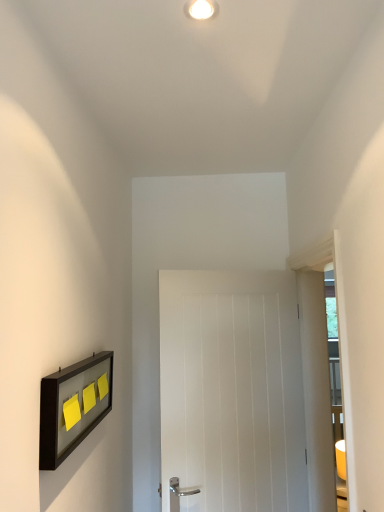
Question: Relative to matte black picture frame at left, is yellow matte/light switch at left, which is the 2th light switch in front-to-back order, in front or behind?

Choices:
 (A) front
 (B) behind

Answer: (B)

Question: From a real-world perspective, is yellow matte/light switch at left, which is the 2th light switch in front-to-back order, above or below matte black picture frame at left?

Choices:
 (A) below
 (B) above

Answer: (B)

Question: Which of these objects is positioned closest to the white glossy light fixture at upper center?

Choices:
 (A) yellow matte paper at left, positioned as the 1th light switch in front-to-back order
 (B) yellow matte/light switch at left, which is the 2th light switch in front-to-back order
 (C) matte black picture frame at left
 (D) transparent glass door at right
 (E) white wooden door at center

Answer: (A)

Question: Based on their relative distances, which object is farther from the matte black picture frame at left?

Choices:
 (A) yellow matte paper at left, positioned as the 1th light switch in front-to-back order
 (B) white wooden door at center
 (C) transparent glass door at right
 (D) yellow matte/light switch at left, which is the 2th light switch in front-to-back order
 (E) white glossy light fixture at upper center

Answer: (E)